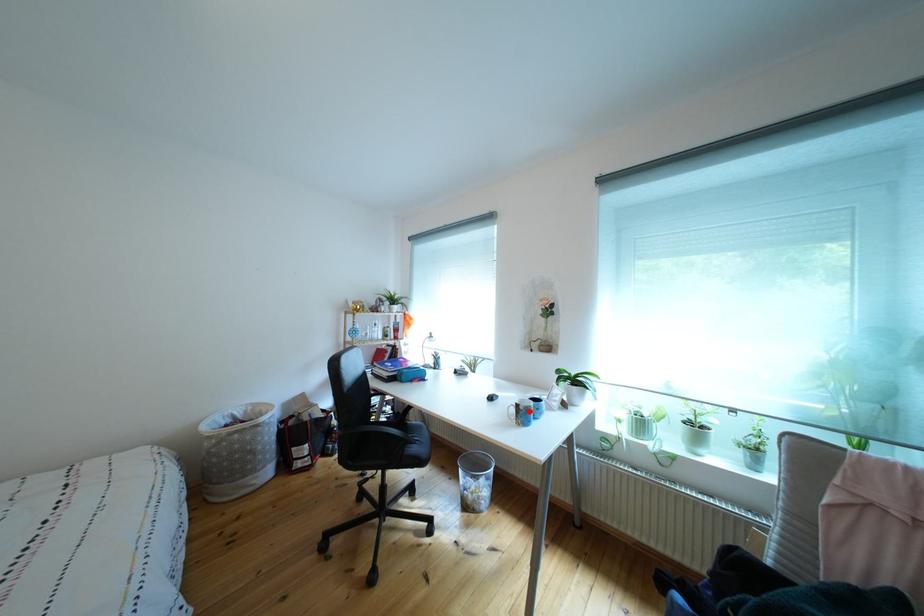
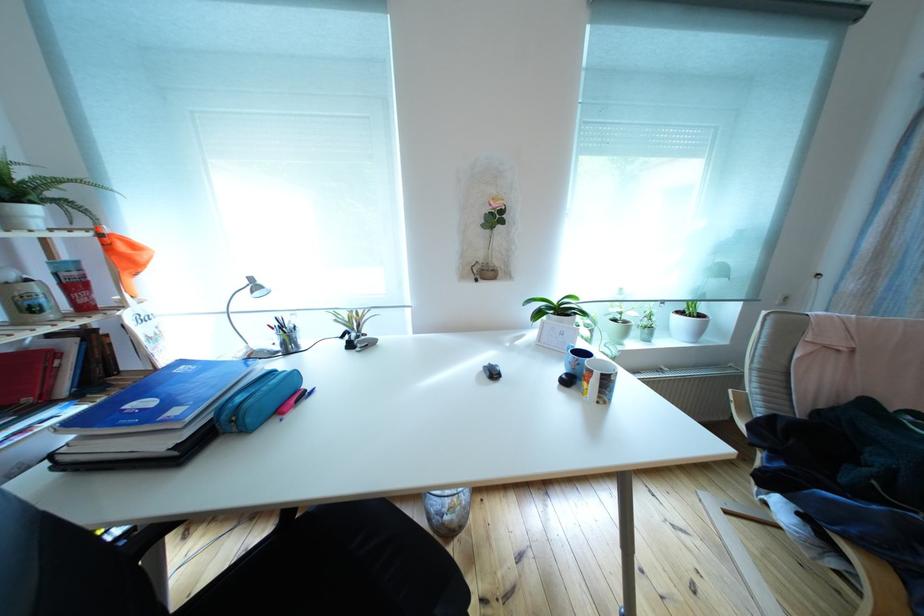
Locate, in the second image, the point that corresponds to the highlighted location in the first image.

(616, 383)